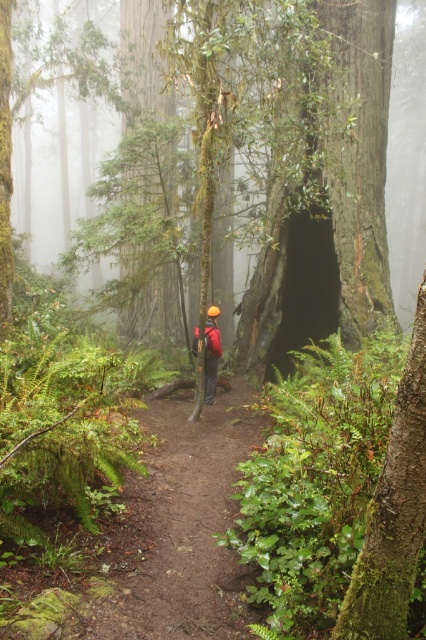
Question: Does brown dirt path at center have a larger size compared to red fabric backpack at center?

Choices:
 (A) yes
 (B) no

Answer: (B)

Question: Does brown dirt path at center appear on the right side of red fabric backpack at center?

Choices:
 (A) no
 (B) yes

Answer: (A)

Question: Is brown dirt path at center smaller than red fabric backpack at center?

Choices:
 (A) no
 (B) yes

Answer: (B)